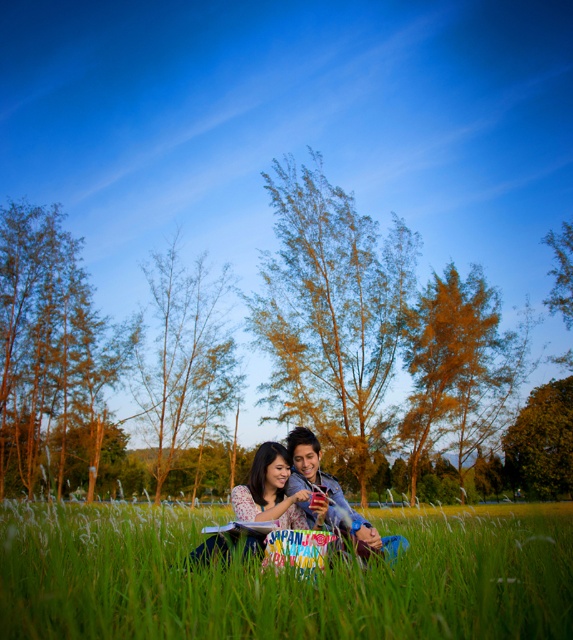
Question: Which point is farther to the camera?

Choices:
 (A) matte plastic phone at center
 (B) green soft grass at lower center

Answer: (A)

Question: Is green soft grass at lower center thinner than matte plastic phone at center?

Choices:
 (A) yes
 (B) no

Answer: (B)

Question: Does green soft grass at lower center have a smaller size compared to matte plastic phone at center?

Choices:
 (A) yes
 (B) no

Answer: (B)

Question: From the image, what is the correct spatial relationship of green soft grass at lower center in relation to matte plastic phone at center?

Choices:
 (A) right
 (B) left

Answer: (A)